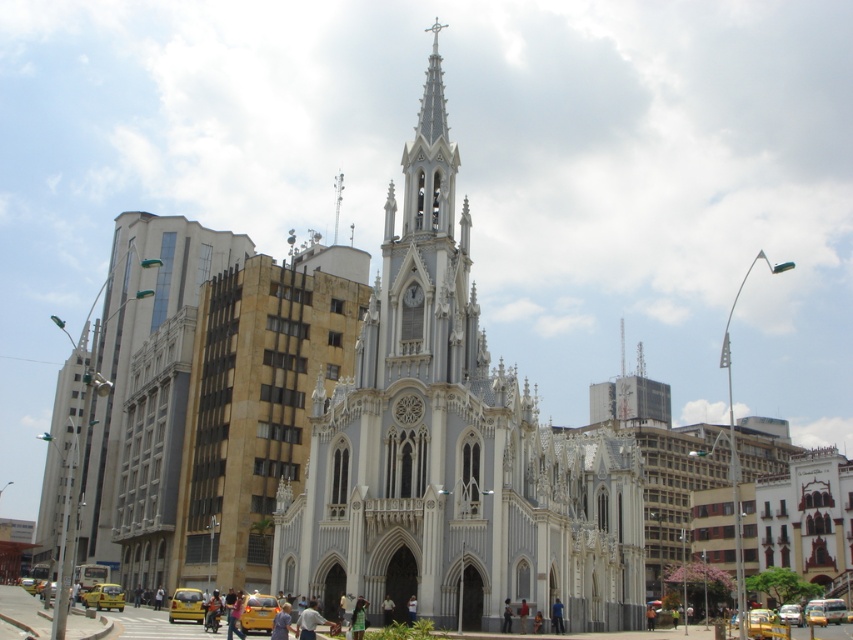
Which is below, white stone church steeple at center or smooth white spire at upper center?

Positioned lower is white stone church steeple at center.

In order to click on white stone church steeple at center in this screenshot , I will do `click(453, 451)`.

Locate an element on the screen. This screenshot has height=640, width=853. white stone church steeple at center is located at coordinates (453, 451).